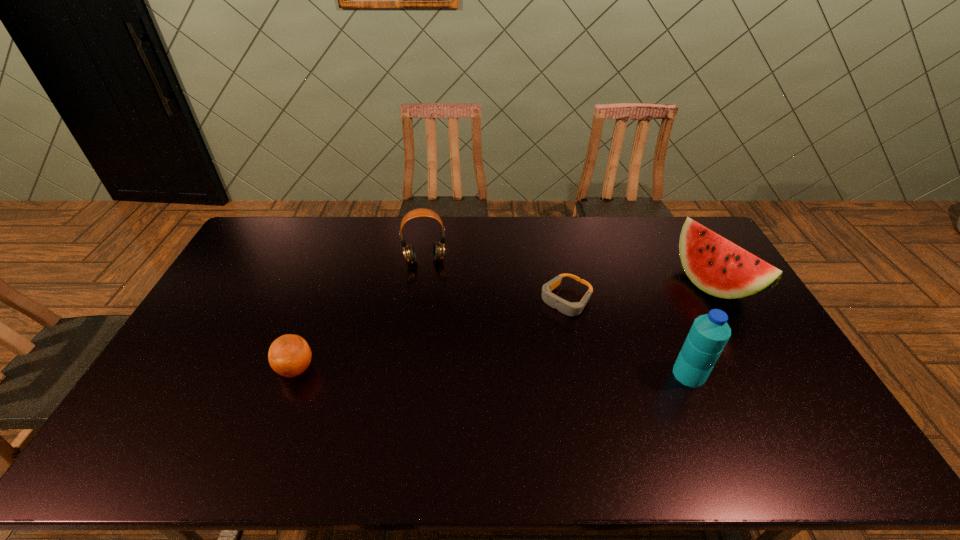
I want to click on vacant space that is in between the second shortest object and the headset, so click(x=361, y=315).

Find the location of a particular element. The width and height of the screenshot is (960, 540). free point between the headset and the orange is located at coordinates (361, 315).

At what (x,y) coordinates should I click in order to perform the action: click on free space between the second object from left to right and the orange. Please return your answer as a coordinate pair (x, y). This screenshot has height=540, width=960. Looking at the image, I should click on (361, 315).

Image resolution: width=960 pixels, height=540 pixels. Identify the location of vacant region between the third object from left to right and the leftmost object. (431, 335).

Image resolution: width=960 pixels, height=540 pixels. I want to click on free area in between the rightmost object and the second object from left to right, so click(x=568, y=272).

Image resolution: width=960 pixels, height=540 pixels. Identify the location of empty space between the shortest object and the fourth object from right to left. (495, 280).

You are a GUI agent. You are given a task and a screenshot of the screen. Output one action in this format:
    pyautogui.click(x=<x>, y=<y>)
    Task: Click on the empty space that is in between the orange and the goggles
    
    Given the screenshot: What is the action you would take?
    coord(431,335)

Point out which object is positioned as the second nearest to the second object from right to left. Please provide its 2D coordinates. Your answer should be formatted as a tuple, i.e. [(x, y)], where the tuple contains the x and y coordinates of a point satisfying the conditions above.

[(568, 308)]

Identify the location of the fourth closest object relative to the goggles. (289, 355).

The width and height of the screenshot is (960, 540). What are the coordinates of `vacant space that satisfies the following two spatial constraints: 1. on the back side of the rightmost object; 2. on the right side of the water bottle` in the screenshot? It's located at (651, 284).